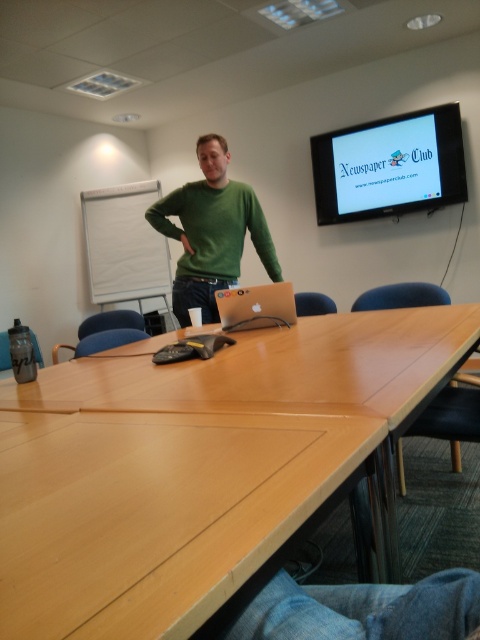
Based on the scene described, where is the light brown wood table at center in relation to the matte plastic screen at upper right?

The light brown wood table at center is located to the left of the matte plastic screen at upper right.

You are an office assistant who needs to locate the matte plastic screen at upper right and the green matte sweater at center. From the perspective of someone standing at the entrance of the conference room, which object is closer to the front of the room?

The matte plastic screen at upper right is positioned over the green matte sweater at center, meaning it is closer to the front of the room from the entrance perspective.

You are standing in the conference room and need to place a document on the light brown wood table at center. Based on the coordinates provided, where exactly on the table should you place it?

The light brown wood table at center is located at coordinates point (194, 465), so you should place the document there.